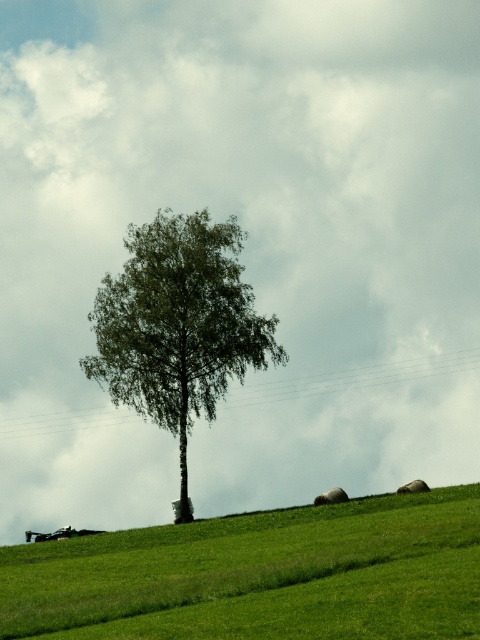
Does green grassy hillside at lower center have a greater width compared to green leafy tree at center?

Correct, the width of green grassy hillside at lower center exceeds that of green leafy tree at center.

Who is more distant from viewer, [264,570] or [236,348]?

The point [236,348] is behind.

Does point (350, 596) come behind point (264, 346)?

No, (350, 596) is closer to viewer.

This screenshot has width=480, height=640. In order to click on green grassy hillside at lower center in this screenshot , I will do `click(260, 576)`.